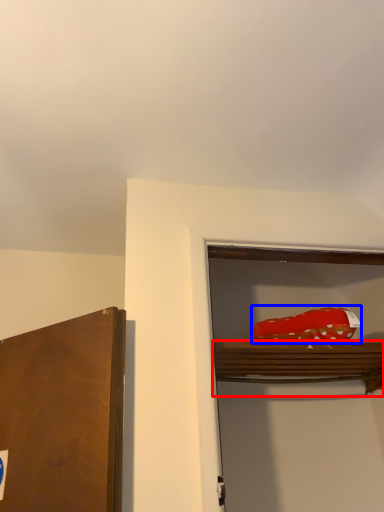
Question: Which point is closer to the camera, shelf (highlighted by a red box) or food (highlighted by a blue box)?

Choices:
 (A) shelf
 (B) food

Answer: (A)